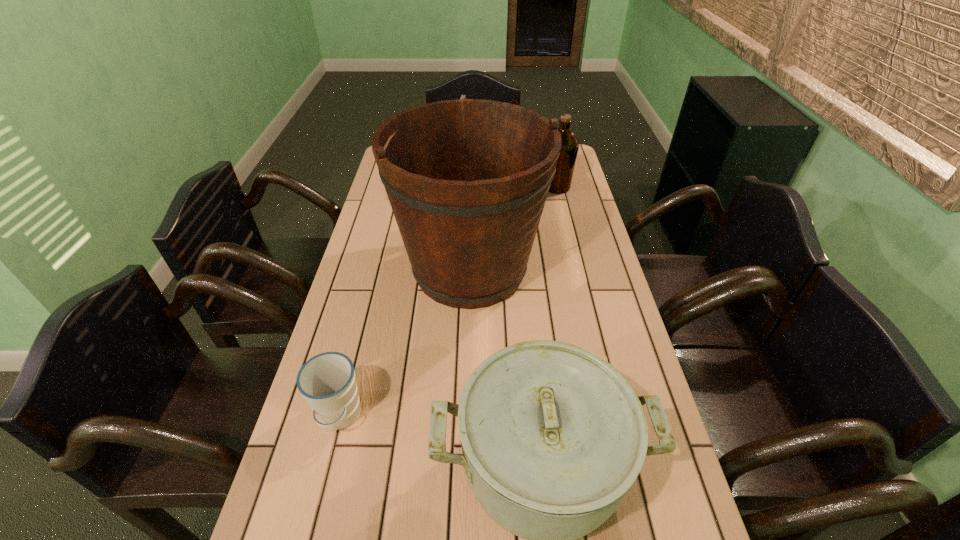
This screenshot has height=540, width=960. What are the coordinates of `vacant space that is in between the tallest object and the shortest object` in the screenshot? It's located at (404, 343).

Identify which object is the second nearest to the olive oil. Please provide its 2D coordinates. Your answer should be formatted as a tuple, i.e. [(x, y)], where the tuple contains the x and y coordinates of a point satisfying the conditions above.

[(463, 96)]

Identify the location of the second closest object to the cup. (467, 179).

Locate an element on the screen. The width and height of the screenshot is (960, 540). free location that satisfies the following two spatial constraints: 1. on the label of the olive oil; 2. with a handle on the side of the cup is located at coordinates (612, 416).

Image resolution: width=960 pixels, height=540 pixels. Identify the location of vacant space that satisfies the following two spatial constraints: 1. on the label of the olive oil; 2. with a handle on the side of the cup. (612, 416).

Where is `free space that satisfies the following two spatial constraints: 1. on the label of the olive oil; 2. with a handle on the side of the shortest object`? Image resolution: width=960 pixels, height=540 pixels. free space that satisfies the following two spatial constraints: 1. on the label of the olive oil; 2. with a handle on the side of the shortest object is located at coordinates (612, 416).